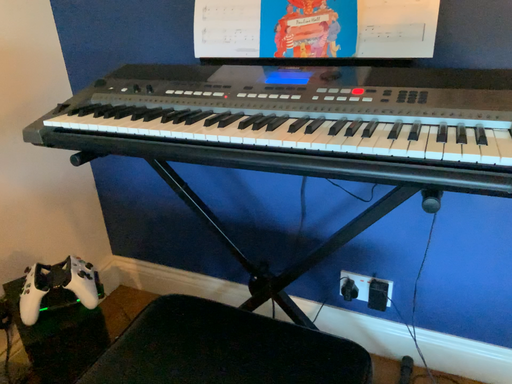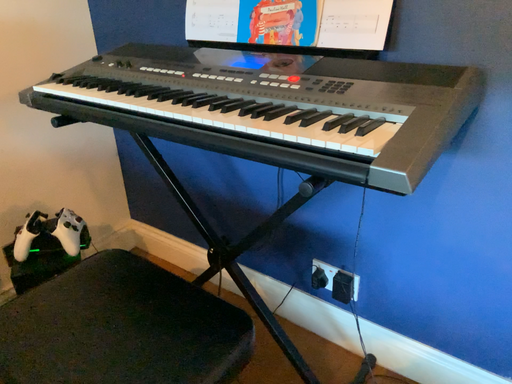
Question: How did the camera likely rotate when shooting the video?

Choices:
 (A) rotated left
 (B) rotated right

Answer: (A)